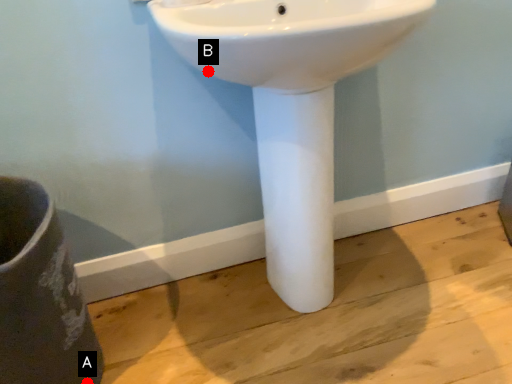
Question: Two points are circled on the image, labeled by A and B beside each circle. Which point is closer to the camera?

Choices:
 (A) A is closer
 (B) B is closer

Answer: (B)